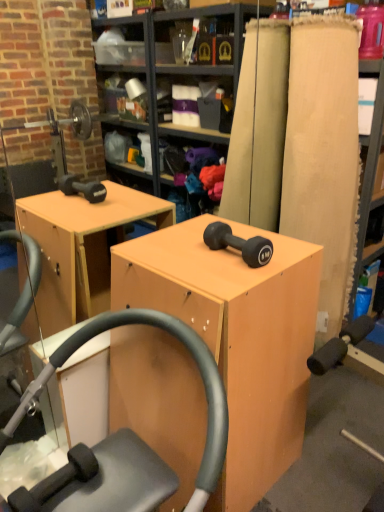
Question: Is matte wood cabinet at center inside or outside of matte black dumbbell at center?

Choices:
 (A) outside
 (B) inside

Answer: (A)

Question: From a real-world perspective, is matte wood cabinet at center above or below matte black dumbbell at center?

Choices:
 (A) below
 (B) above

Answer: (A)

Question: Which object is the farthest from the matte wood cabinet at center?

Choices:
 (A) matte wood plank at right
 (B) matte black dumbbell at center

Answer: (A)

Question: Which of these objects is positioned closest to the matte black dumbbell at center?

Choices:
 (A) matte wood plank at right
 (B) matte wood cabinet at center

Answer: (B)